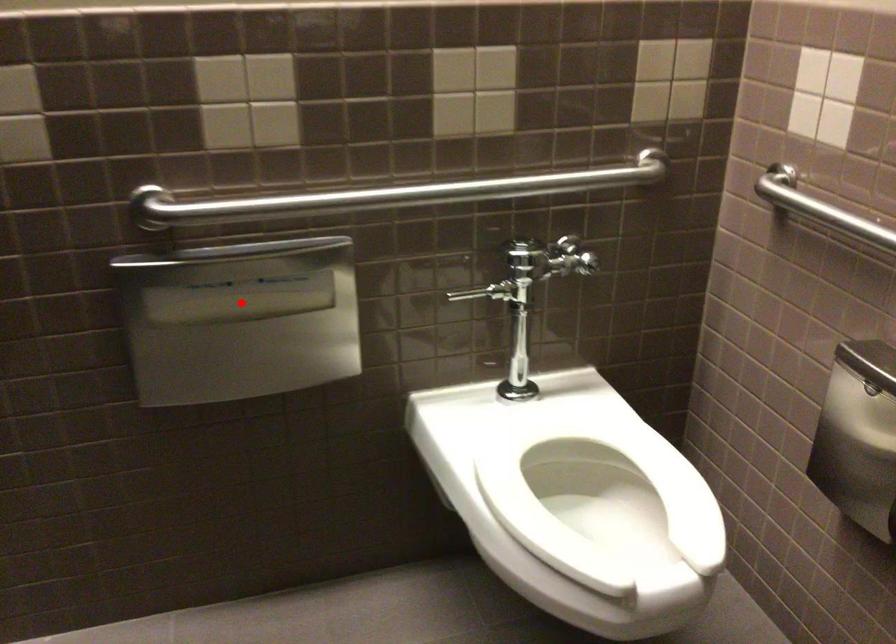
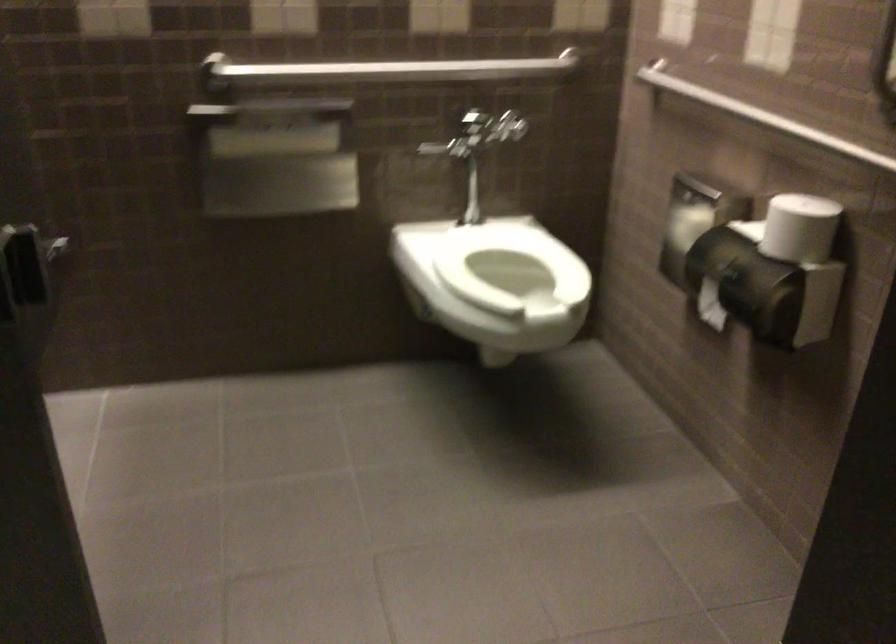
Locate, in the second image, the point that corresponds to the highlighted location in the first image.

(273, 143)